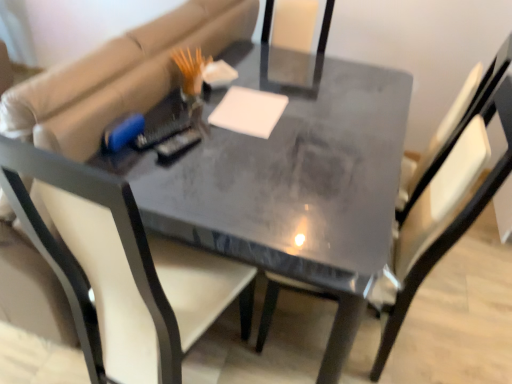
What is the approximate width of matte black chair at center, which appears as the second chair when viewed from the right?

matte black chair at center, which appears as the second chair when viewed from the right, is 3.39 feet in width.

What do you see at coordinates (248, 111) in the screenshot? This screenshot has width=512, height=384. I see `white matte notepad at center` at bounding box center [248, 111].

What do you see at coordinates (264, 187) in the screenshot? The height and width of the screenshot is (384, 512). I see `matte gray table at center` at bounding box center [264, 187].

Find the location of `matte black chair at center, which appears as the second chair when viewed from the right`. matte black chair at center, which appears as the second chair when viewed from the right is located at coordinates (121, 269).

Are matte black chair at center, which is counted as the first chair, starting from the left, and white matte notepad at center located far from each other?

That's not correct — matte black chair at center, which is counted as the first chair, starting from the left, is a little close to white matte notepad at center.

Is matte black chair at center, which appears as the second chair when viewed from the right, facing towards white matte notepad at center?

No, matte black chair at center, which appears as the second chair when viewed from the right, is not aimed at white matte notepad at center.

Can white matte notepad at center be found inside matte black chair at center, which is counted as the first chair, starting from the left?

No, white matte notepad at center is not a part of matte black chair at center, which is counted as the first chair, starting from the left.

Which is behind, point (32, 161) or point (254, 93)?

Positioned behind is point (254, 93).

Which of these two, matte gray table at center or matte gray chair at center, which is the 2th chair from left to right, stands taller?

matte gray chair at center, which is the 2th chair from left to right, is taller.

Which of these two, matte gray table at center or matte gray chair at center, which is the first chair in right-to-left order, is wider?

With larger width is matte gray table at center.

Would you say matte gray table at center is to the left or to the right of matte gray chair at center, which is the 2th chair from left to right, in the picture?

Based on their positions, matte gray table at center is located to the left of matte gray chair at center, which is the 2th chair from left to right.

Does point (168, 190) lie in front of point (489, 68)?

Yes, it is in front of point (489, 68).

Between white matte notepad at center and matte gray table at center, which one appears on the left side from the viewer's perspective?

Positioned to the left is white matte notepad at center.

Looking at their sizes, would you say white matte notepad at center is wider or thinner than matte gray table at center?

Considering their sizes, white matte notepad at center looks slimmer than matte gray table at center.

Can we say white matte notepad at center lies outside matte gray table at center?

That's incorrect, white matte notepad at center is not completely outside matte gray table at center.

Who is more distant, white matte notepad at center or matte gray table at center?

white matte notepad at center is more distant.

Is matte black chair at center, which appears as the second chair when viewed from the right, bigger than matte gray table at center?

Indeed, matte black chair at center, which appears as the second chair when viewed from the right, has a larger size compared to matte gray table at center.

Looking at this image, does matte black chair at center, which is counted as the first chair, starting from the left, lie behind matte gray table at center?

No, it is not.

Is matte black chair at center, which is counted as the first chair, starting from the left, inside or outside of matte gray table at center?

matte black chair at center, which is counted as the first chair, starting from the left, is located beyond the bounds of matte gray table at center.

Is matte black chair at center, which appears as the second chair when viewed from the right, not inside matte gray chair at center, which is the first chair in right-to-left order?

Indeed, matte black chair at center, which appears as the second chair when viewed from the right, is completely outside matte gray chair at center, which is the first chair in right-to-left order.

Considering the relative sizes of matte black chair at center, which appears as the second chair when viewed from the right, and matte gray chair at center, which is the 2th chair from left to right, in the image provided, is matte black chair at center, which appears as the second chair when viewed from the right, taller than matte gray chair at center, which is the 2th chair from left to right,?

No.

Find the location of `chair located underneath the matte gray chair at center, which is the 2th chair from left to right (from a real-world perspective)`. chair located underneath the matte gray chair at center, which is the 2th chair from left to right (from a real-world perspective) is located at coordinates (121, 269).

From the image's perspective, between matte black chair at center, which appears as the second chair when viewed from the right, and matte gray chair at center, which is the 2th chair from left to right, which one is located above?

From the image's view, matte black chair at center, which appears as the second chair when viewed from the right, is above.

Is white matte notepad at center oriented towards matte black chair at center, which is counted as the first chair, starting from the left?

No, white matte notepad at center does not turn towards matte black chair at center, which is counted as the first chair, starting from the left.

Between white matte notepad at center and matte black chair at center, which is counted as the first chair, starting from the left, which one has more height?

Standing taller between the two is matte black chair at center, which is counted as the first chair, starting from the left.

Considering the sizes of white matte notepad at center and matte black chair at center, which appears as the second chair when viewed from the right, in the image, is white matte notepad at center bigger or smaller than matte black chair at center, which appears as the second chair when viewed from the right,?

white matte notepad at center is smaller than matte black chair at center, which appears as the second chair when viewed from the right.

Does point (218, 119) come farther from viewer compared to point (4, 169)?

Yes.

Is white matte notepad at center outside of matte gray chair at center, which is the 2th chair from left to right?

Absolutely, white matte notepad at center is external to matte gray chair at center, which is the 2th chair from left to right.

Are white matte notepad at center and matte gray chair at center, which is the 2th chair from left to right, beside each other?

There is a gap between white matte notepad at center and matte gray chair at center, which is the 2th chair from left to right.

Is white matte notepad at center oriented away from matte gray chair at center, which is the 2th chair from left to right?

That's not correct — white matte notepad at center is not looking away from matte gray chair at center, which is the 2th chair from left to right.

Locate an element on the screen. notepad below the matte black chair at center, which appears as the second chair when viewed from the right (from the image's perspective) is located at coordinates (248, 111).

This screenshot has height=384, width=512. Identify the location of table above the matte gray chair at center, which is the 2th chair from left to right (from the image's perspective). (264, 187).

Estimate the real-world distances between objects in this image. Which object is closer to matte black chair at center, which appears as the second chair when viewed from the right, white matte notepad at center or matte gray chair at center, which is the 2th chair from left to right?

white matte notepad at center.

Estimate the real-world distances between objects in this image. Which object is further from matte gray table at center, matte gray chair at center, which is the first chair in right-to-left order, or matte black chair at center, which appears as the second chair when viewed from the right?

Based on the image, matte gray chair at center, which is the first chair in right-to-left order, appears to be further to matte gray table at center.

Looking at the image, which one is located further to matte gray table at center, matte black chair at center, which appears as the second chair when viewed from the right, or white matte notepad at center?

white matte notepad at center is further to matte gray table at center.

Looking at the image, which one is located closer to matte black chair at center, which is counted as the first chair, starting from the left, matte gray chair at center, which is the 2th chair from left to right, or matte gray table at center?

Based on the image, matte gray table at center appears to be nearer to matte black chair at center, which is counted as the first chair, starting from the left.

When comparing their distances from matte black chair at center, which appears as the second chair when viewed from the right, does matte gray table at center or white matte notepad at center seem further?

white matte notepad at center is further to matte black chair at center, which appears as the second chair when viewed from the right.

When comparing their distances from white matte notepad at center, does matte black chair at center, which is counted as the first chair, starting from the left, or matte gray table at center seem further?

matte black chair at center, which is counted as the first chair, starting from the left, lies further to white matte notepad at center than the other object.

Considering their positions, is white matte notepad at center positioned closer to matte black chair at center, which is counted as the first chair, starting from the left, than matte gray table at center?

matte gray table at center lies closer to matte black chair at center, which is counted as the first chair, starting from the left, than the other object.

From the image, which object appears to be nearer to matte gray chair at center, which is the first chair in right-to-left order, matte gray table at center or white matte notepad at center?

Among the two, matte gray table at center is located nearer to matte gray chair at center, which is the first chair in right-to-left order.

You are a GUI agent. You are given a task and a screenshot of the screen. Output one action in this format:
    pyautogui.click(x=<x>, y=<y>)
    Task: Click on the table between matte gray chair at center, which is the first chair in right-to-left order, and white matte notepad at center from front to back
    
    Given the screenshot: What is the action you would take?
    pyautogui.click(x=264, y=187)

Where is `table between matte black chair at center, which is counted as the first chair, starting from the left, and matte gray chair at center, which is the first chair in right-to-left order`? The image size is (512, 384). table between matte black chair at center, which is counted as the first chair, starting from the left, and matte gray chair at center, which is the first chair in right-to-left order is located at coordinates click(264, 187).

Where is `notepad between matte black chair at center, which appears as the second chair when viewed from the right, and matte gray table at center`? This screenshot has width=512, height=384. notepad between matte black chair at center, which appears as the second chair when viewed from the right, and matte gray table at center is located at coordinates (248, 111).

Identify the location of notepad between matte black chair at center, which appears as the second chair when viewed from the right, and matte gray chair at center, which is the 2th chair from left to right. (248, 111).